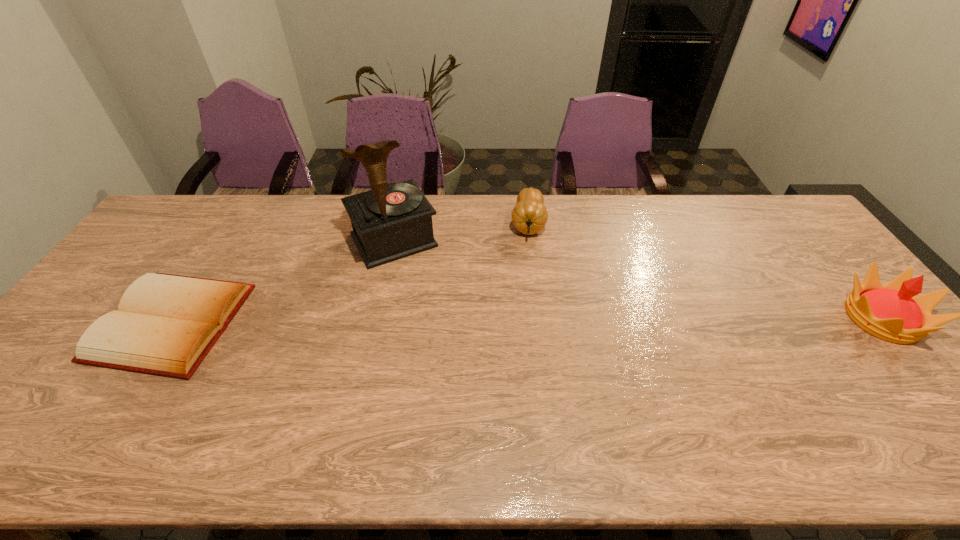
Where is `vacant space situated 0.170m at the horn opening of the tallest object`? The width and height of the screenshot is (960, 540). vacant space situated 0.170m at the horn opening of the tallest object is located at coordinates (432, 304).

The image size is (960, 540). Identify the location of vacant space located at the horn opening of the tallest object. (438, 314).

Image resolution: width=960 pixels, height=540 pixels. Find the location of `vacant point located at the horn opening of the tallest object`. vacant point located at the horn opening of the tallest object is located at coordinates (432, 304).

You are a GUI agent. You are given a task and a screenshot of the screen. Output one action in this format:
    pyautogui.click(x=<x>, y=<y>)
    Task: Click on the vacant area situated 0.290m on the stem side of the gourd
    This screenshot has height=540, width=960.
    Given the screenshot: What is the action you would take?
    pyautogui.click(x=524, y=314)

Find the location of `free space located 0.380m on the stem side of the gourd`. free space located 0.380m on the stem side of the gourd is located at coordinates (523, 340).

Image resolution: width=960 pixels, height=540 pixels. I want to click on vacant region located on the stem side of the gourd, so click(524, 320).

You are a GUI agent. You are given a task and a screenshot of the screen. Output one action in this format:
    pyautogui.click(x=<x>, y=<y>)
    Task: Click on the phonograph_record that is at the far edge
    
    Given the screenshot: What is the action you would take?
    pyautogui.click(x=392, y=221)

This screenshot has width=960, height=540. I want to click on gourd positioned at the far edge, so click(x=529, y=215).

You are a GUI agent. You are given a task and a screenshot of the screen. Output one action in this format:
    pyautogui.click(x=<x>, y=<y>)
    Task: Click on the object located in the left edge section of the desktop
    Image resolution: width=960 pixels, height=540 pixels.
    Given the screenshot: What is the action you would take?
    pyautogui.click(x=166, y=324)

Where is `object positioned at the right edge`? This screenshot has width=960, height=540. object positioned at the right edge is located at coordinates (892, 312).